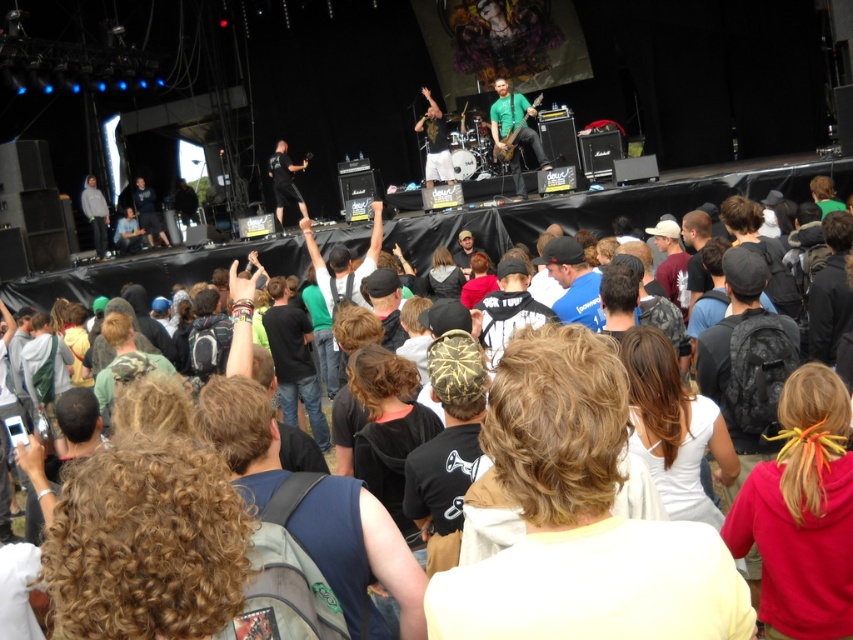
You are a photographer at the concert and want to capture both the light yellow shirt at center and the green fabric shirt at center in a single shot. Since your camera has a limited focus range, which shirt should you focus on first to ensure it appears clearer in the photo?

The light yellow shirt at center is shorter than the green fabric shirt at center, so focusing on the light yellow shirt at center first would ensure it appears clearer in the photo.

You are a photographer at the concert and want to take a photo of the green fabric shirt at center and the gray hoodie at left. However, you can only focus on one person at a time. Which person should you focus on to ensure the other is still visible in the frame?

The green fabric shirt at center is positioned over gray hoodie at left, so focusing on the green fabric shirt at center will keep the gray hoodie at left visible in the frame.

You are a photographer at the concert and want to take a photo of the two people wearing the light yellow shirt at center and green fabric shirt at center. Which one is positioned lower in the image?

The light yellow shirt at center is positioned below the green fabric shirt at center, so it is lower in the image.